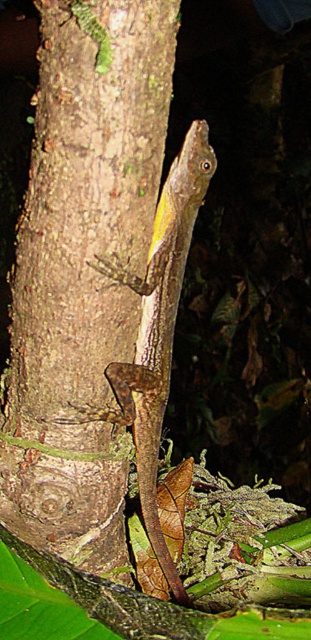
Which is in front, point (108, 160) or point (179, 211)?

Positioned in front is point (108, 160).

Between brown rough tree trunk at center and brown textured lizard at center, which one has less height?

brown textured lizard at center

What do you see at coordinates (82, 272) in the screenshot? This screenshot has width=311, height=640. I see `brown rough tree trunk at center` at bounding box center [82, 272].

The image size is (311, 640). I want to click on brown rough tree trunk at center, so click(x=82, y=272).